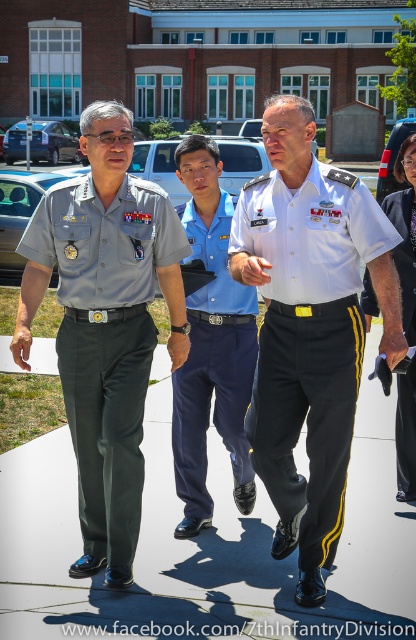
Does white cotton shirt at center appear on the right side of blue cotton shirt at center?

Correct, you'll find white cotton shirt at center to the right of blue cotton shirt at center.

Does white cotton shirt at center appear under blue cotton shirt at center?

Correct, white cotton shirt at center is located below blue cotton shirt at center.

Is point (277, 342) positioned in front of point (239, 428)?

That is True.

Where is `white cotton shirt at center`? The width and height of the screenshot is (416, 640). white cotton shirt at center is located at coordinates (307, 340).

Who is more distant from viewer, [361,524] or [364,284]?

Positioned behind is point [364,284].

Is dark gray concrete pavement at center behind black smooth pants at right?

No, dark gray concrete pavement at center is in front of black smooth pants at right.

Image resolution: width=416 pixels, height=640 pixels. I want to click on dark gray concrete pavement at center, so click(207, 547).

Who is positioned more to the right, white cotton shirt at center or matte gray uniform at left?

white cotton shirt at center

Who is more distant from viewer, (277, 196) or (98, 376)?

The point (98, 376) is more distant.

In order to click on white cotton shirt at center in this screenshot , I will do `click(307, 340)`.